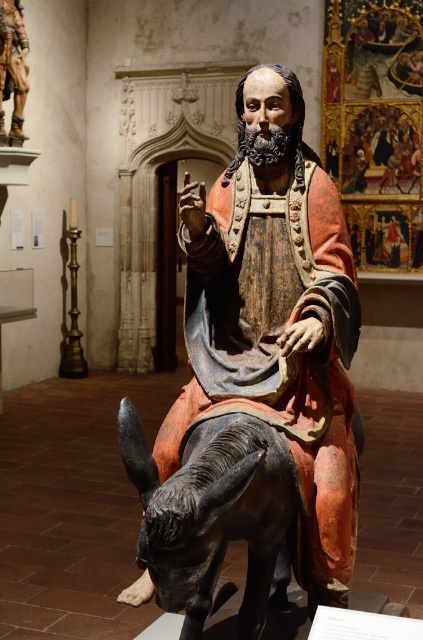
You are an art conservator examining the sculpture. You notice two points on the sculpture at coordinates point (156, 490) and point (249, 472). Which point is closer to the viewer?

Point (249, 472) is closer to the viewer because the Objects Description states that point (156, 490) is behind point (249, 472).

You are an art conservator examining the sculpture. You need to determine which object is taller between the polychrome wood statue at center and the wooden figure at upper left. Based on the scene, which one is taller?

The polychrome wood statue at center is much taller than the wooden figure at upper left.

You are an art conservator examining the sculpture. You need to clean the shiny black donkey at lower left without disturbing the polychrome wood statue at center. Which object should you approach first based on their spatial relationship?

The shiny black donkey at lower left is behind the polychrome wood statue at center, so you should approach the polychrome wood statue at center first to avoid obstructing access to the donkey.